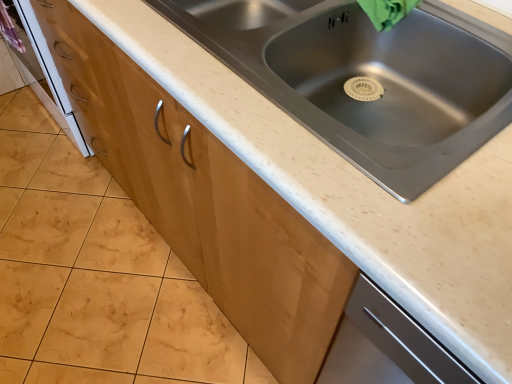
Question: From a real-world perspective, relative to stainless steel sink at center, is white glossy oven at lower left vertically above or below?

Choices:
 (A) below
 (B) above

Answer: (A)

Question: In the image, is white glossy oven at lower left on the left side or the right side of stainless steel sink at center?

Choices:
 (A) left
 (B) right

Answer: (A)

Question: Estimate the real-world distances between objects in this image. Which object is closer to the stainless steel sink at center?

Choices:
 (A) white glossy oven at lower left
 (B) matte wood cabinet at center

Answer: (B)

Question: Considering the real-world distances, which object is farthest from the white glossy oven at lower left?

Choices:
 (A) stainless steel sink at center
 (B) matte wood cabinet at center

Answer: (A)